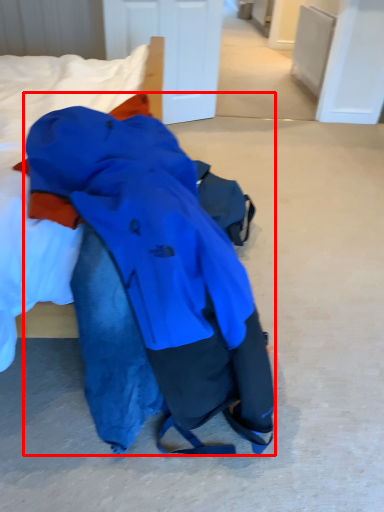
Question: Considering the relative positions of jacket (annotated by the red box) and bed in the image provided, where is jacket (annotated by the red box) located with respect to the staircase?

Choices:
 (A) left
 (B) right

Answer: (B)